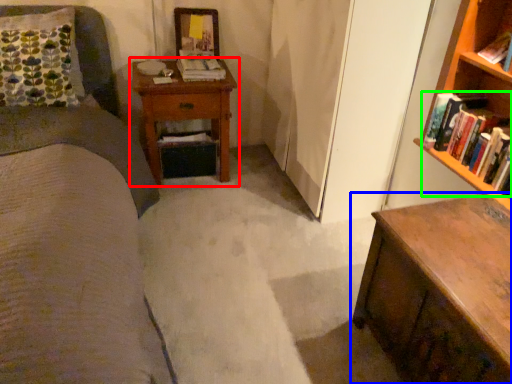
Question: Estimate the real-world distances between objects in this image. Which object is closer to nightstand (highlighted by a red box), chest of drawers (highlighted by a blue box) or book (highlighted by a green box)?

Choices:
 (A) chest of drawers
 (B) book

Answer: (B)